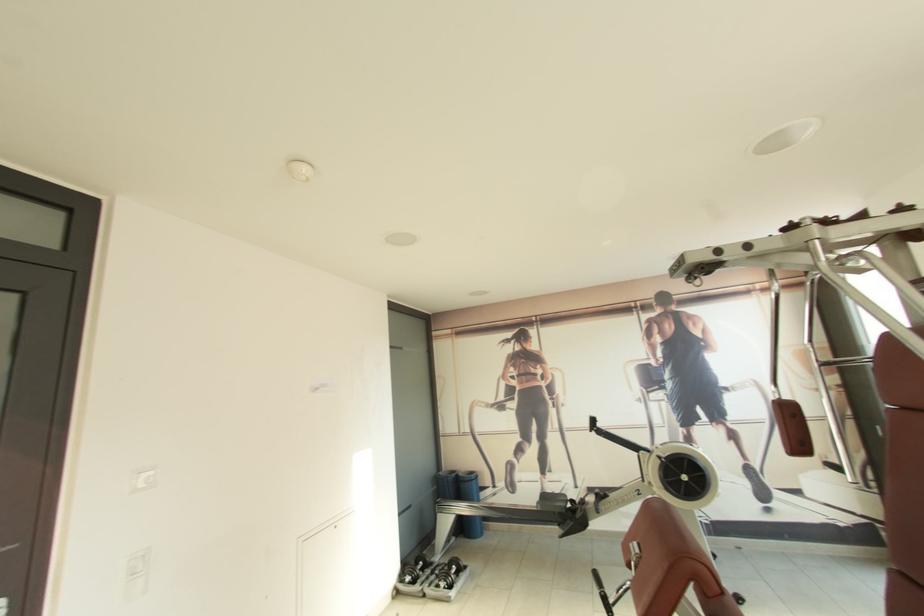
At what (x,y) coordinates should I click in order to perform the action: click on rowing machine handle. Please return your answer as a coordinate pair (x, y). The height and width of the screenshot is (616, 924). Looking at the image, I should click on (476, 424).